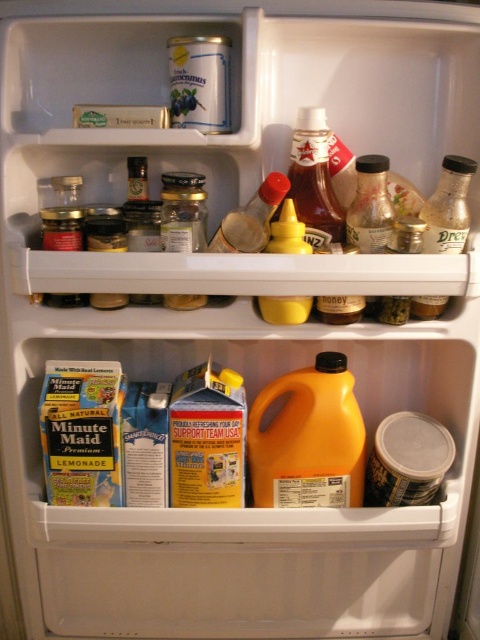
You are organizing the fridge and need to move the clear plastic bottle at right and the yellow matte mustard at center. Which one should you move first if you want to access the one underneath?

You should move the clear plastic bottle at right first because it is positioned over the yellow matte mustard at center, so removing it will allow access to the mustard underneath.

You need to place a new jar of jam that requires 10 units of space. You have the translucent plastic ketchup bottle at upper center and the matte glass bottle at center in the fridge. Which one can you move to free up enough space?

The translucent plastic ketchup bottle at upper center occupies less space than the matte glass bottle at center. Therefore, moving the matte glass bottle at center would free up more space, which is needed for the jar requiring 10 units.

You are looking into the refrigerator and see two points marked inside. One is at coordinate point(335, 451) and the other at point(279, 230). Which point is closer to you?

Point(335, 451) is further to the camera than point(279, 230), so the point closer to you is point(279, 230).